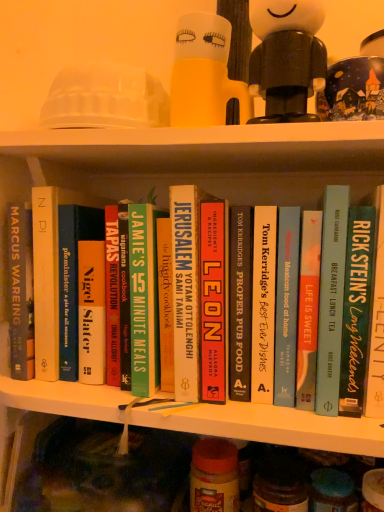
Image resolution: width=384 pixels, height=512 pixels. In order to click on free space on the front side of hardcover cookbook at center, which is the third book in left-to-right order in this screenshot , I will do `click(220, 406)`.